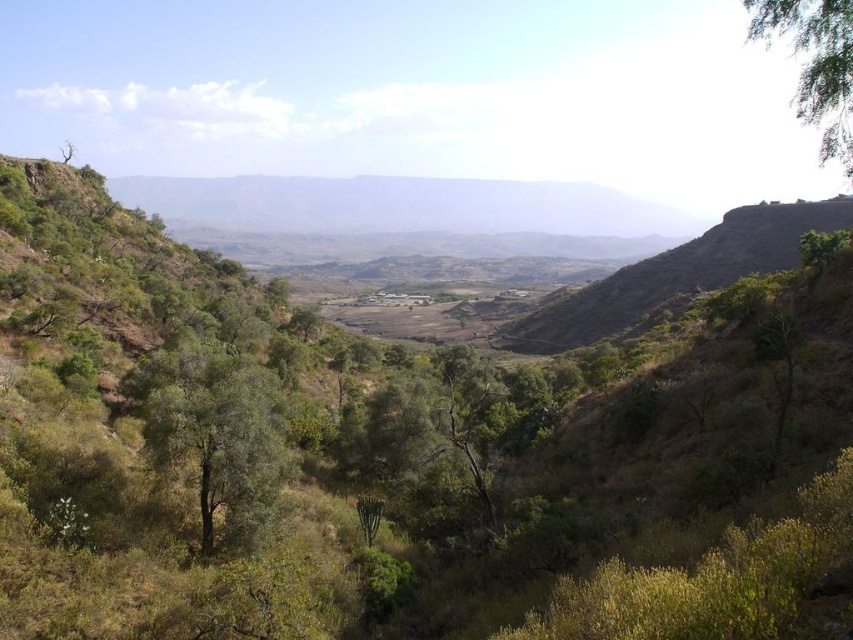
Question: Which object appears farthest from the camera in this image?

Choices:
 (A) green leafy tree at upper right
 (B) green leafy tree at center

Answer: (B)

Question: Is green leafy tree at center wider than green leafy tree at upper right?

Choices:
 (A) yes
 (B) no

Answer: (B)

Question: Considering the relative positions of green leafy tree at center and green leafy tree at upper right in the image provided, where is green leafy tree at center located with respect to green leafy tree at upper right?

Choices:
 (A) right
 (B) left

Answer: (B)

Question: Is green leafy tree at center to the right of green leafy tree at upper right from the viewer's perspective?

Choices:
 (A) yes
 (B) no

Answer: (B)

Question: Among these points, which one is nearest to the camera?

Choices:
 (A) (828, 51)
 (B) (233, 387)

Answer: (A)